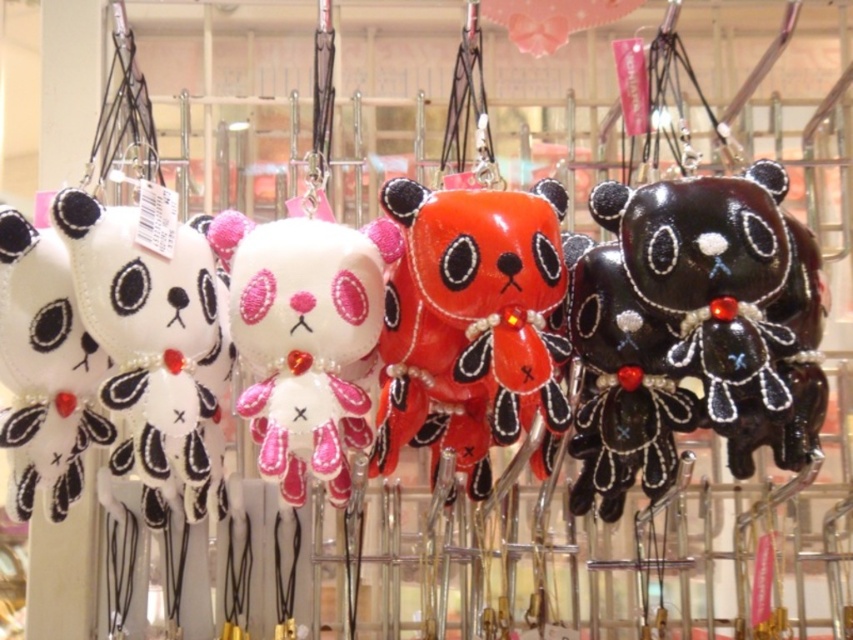
Between point (488, 369) and point (80, 426), which one is positioned in front?

Point (488, 369)

Does shiny orange plush bear at center have a smaller size compared to matte black plush bear at left?

Actually, shiny orange plush bear at center might be larger than matte black plush bear at left.

At what (x,y) coordinates should I click in order to perform the action: click on shiny orange plush bear at center. Please return your answer as a coordinate pair (x, y). Image resolution: width=853 pixels, height=640 pixels. Looking at the image, I should click on (469, 323).

Image resolution: width=853 pixels, height=640 pixels. I want to click on shiny orange plush bear at center, so click(x=469, y=323).

Can you confirm if glossy black bear at right is positioned above matte black plush bear at left?

Incorrect, glossy black bear at right is not positioned above matte black plush bear at left.

From the picture: Is glossy black bear at right to the right of matte black plush bear at left from the viewer's perspective?

Correct, you'll find glossy black bear at right to the right of matte black plush bear at left.

Is point (618, 394) positioned before point (105, 419)?

Yes, point (618, 394) is closer to viewer.

Identify the location of glossy black bear at right. (688, 332).

Which is in front, point (416, 234) or point (369, 301)?

Point (416, 234) is more forward.

In the scene shown: Can you confirm if shiny orange plush bear at center is smaller than white felt plush at center?

Actually, shiny orange plush bear at center might be larger than white felt plush at center.

Does point (538, 296) come in front of point (332, 451)?

No, (538, 296) is further to viewer.

The height and width of the screenshot is (640, 853). Find the location of `shiny orange plush bear at center`. shiny orange plush bear at center is located at coordinates (469, 323).